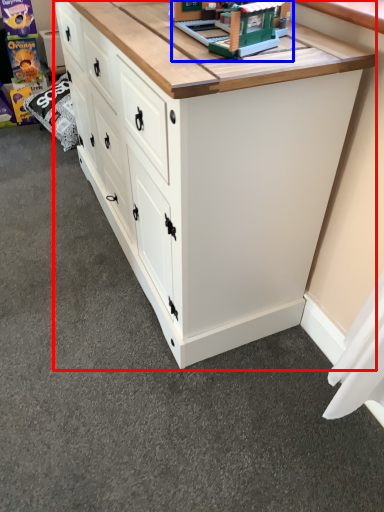
Question: Which object appears farthest to the camera in this image, chest of drawers (highlighted by a red box) or toy (highlighted by a blue box)?

Choices:
 (A) chest of drawers
 (B) toy

Answer: (B)